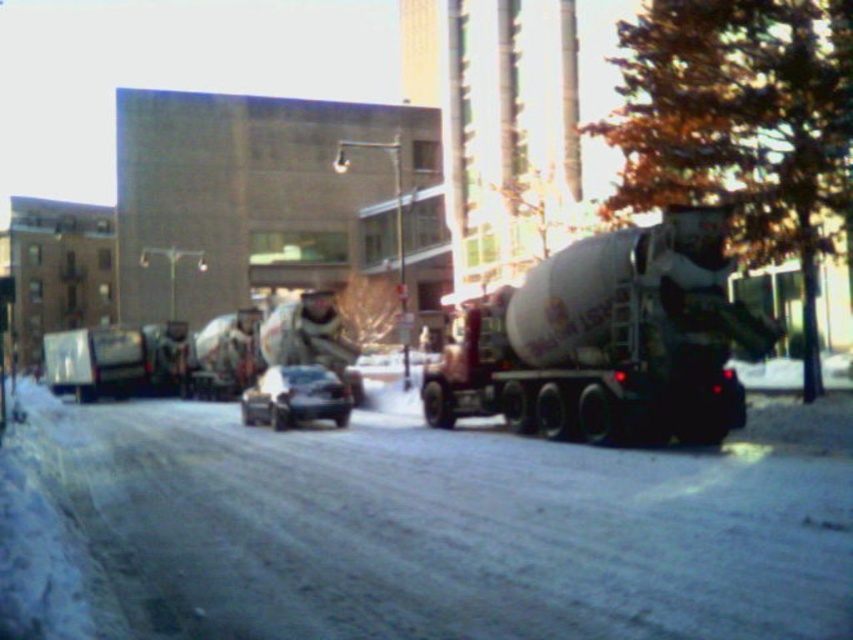
Question: Among these points, which one is farthest from the camera?

Choices:
 (A) (805, 580)
 (B) (268, 378)
 (C) (708, 420)

Answer: (B)

Question: Does white matte cement truck at right appear under shiny black sedan at center?

Choices:
 (A) no
 (B) yes

Answer: (A)

Question: From the image, what is the correct spatial relationship of white matte cement truck at right in relation to shiny black sedan at center?

Choices:
 (A) left
 (B) right

Answer: (B)

Question: Which object appears closest to the camera in this image?

Choices:
 (A) white matte cement truck at right
 (B) smooth concrete mixer at center

Answer: (B)

Question: Can you confirm if smooth concrete mixer at center is wider than white matte cement truck at right?

Choices:
 (A) no
 (B) yes

Answer: (B)

Question: Which of these objects is positioned closest to the smooth concrete mixer at center?

Choices:
 (A) shiny black sedan at center
 (B) white matte cement truck at right

Answer: (B)